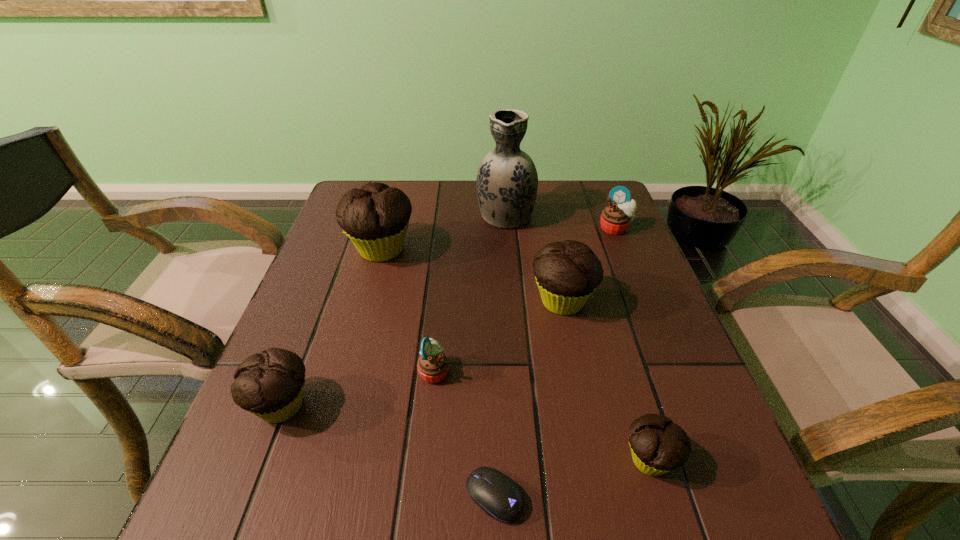
What are the coordinates of `the smaller pink muffin` in the screenshot? It's located at (433, 365).

Image resolution: width=960 pixels, height=540 pixels. I want to click on the smallest chocolate muffin, so click(x=658, y=445).

You are a GUI agent. You are given a task and a screenshot of the screen. Output one action in this format:
    pyautogui.click(x=<x>, y=<y>)
    Task: Click on the computer mouse
    The width and height of the screenshot is (960, 540).
    Given the screenshot: What is the action you would take?
    pyautogui.click(x=496, y=494)

Identify the location of the shortest object. (496, 494).

Image resolution: width=960 pixels, height=540 pixels. Find the location of `vacant space located 0.230m on the back of the biggest chocolate muffin`. vacant space located 0.230m on the back of the biggest chocolate muffin is located at coordinates (398, 187).

Where is `vacant space situated 0.110m on the right of the sixth shortest object`? This screenshot has width=960, height=540. vacant space situated 0.110m on the right of the sixth shortest object is located at coordinates (644, 301).

Identify the location of vacant space located 0.320m on the front-facing side of the rightmost object. (655, 326).

This screenshot has width=960, height=540. I want to click on vacant area situated on the right of the third biggest chocolate muffin, so click(x=511, y=406).

Identify the location of free region located on the front-facing side of the smaller pink muffin. The width and height of the screenshot is (960, 540). (654, 371).

Where is `free space located on the back of the smallest chocolate muffin`? This screenshot has height=540, width=960. free space located on the back of the smallest chocolate muffin is located at coordinates (600, 293).